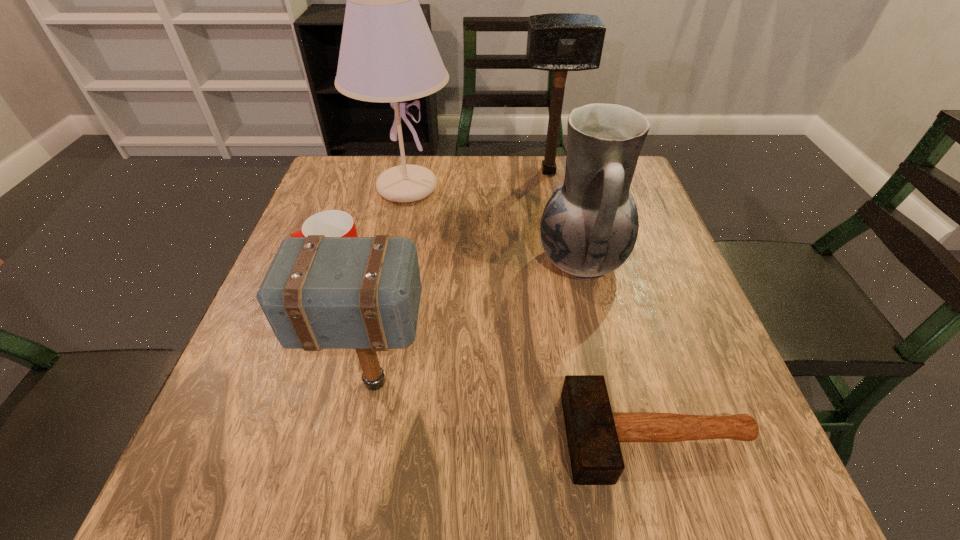
At what (x,y) coordinates should I click in order to perform the action: click on free space located on the front-facing side of the pitcher. Please return your answer as a coordinate pair (x, y). The image size is (960, 540). Looking at the image, I should click on (420, 261).

The height and width of the screenshot is (540, 960). Identify the location of free space located 0.330m on the front-facing side of the pitcher. (390, 261).

The image size is (960, 540). Identify the location of vacant space positioned 0.370m on the striking surface of the second shortest mallet. (640, 382).

Find the location of a particular element. free space located 0.320m on the hammer head face of the shortest object is located at coordinates (365, 437).

At what (x,y) coordinates should I click in order to perform the action: click on vacant space situated on the hammer head face of the shortest object. Please return your answer as a coordinate pair (x, y). Looking at the image, I should click on (453, 437).

The height and width of the screenshot is (540, 960). I want to click on free space located on the hammer head face of the shortest object, so click(529, 437).

Locate an element on the screen. Image resolution: width=960 pixels, height=540 pixels. lampshade at the far edge is located at coordinates [x=387, y=54].

I want to click on mallet located in the far edge section of the desktop, so click(x=560, y=42).

Image resolution: width=960 pixels, height=540 pixels. Identify the location of object located in the near edge section of the desktop. (593, 432).

What are the coordinates of `lampshade that is at the left edge` in the screenshot? It's located at (387, 54).